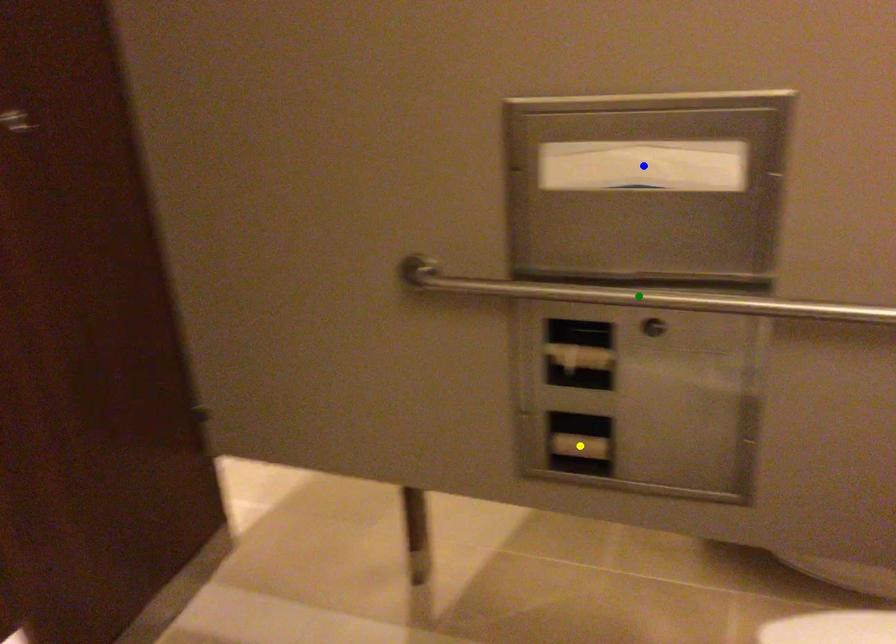
Based on the photo, order these from nearest to farthest:
- yellow point
- blue point
- green point

1. yellow point
2. blue point
3. green point